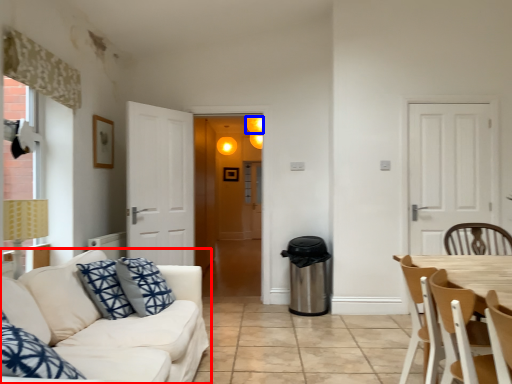
Question: Among these objects, which one is farthest to the camera, studio couch (highlighted by a red box) or light (highlighted by a blue box)?

Choices:
 (A) studio couch
 (B) light

Answer: (B)